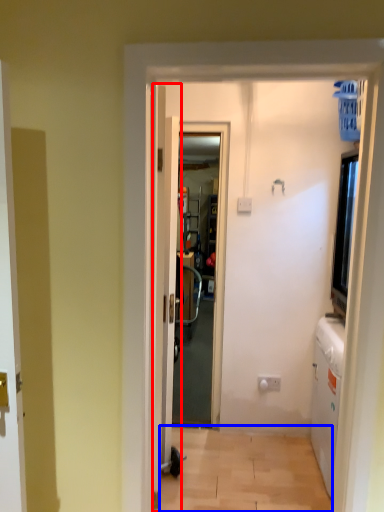
Question: Among these objects, which one is nearest to the camera, door (highlighted by a red box) or corridor (highlighted by a blue box)?

Choices:
 (A) door
 (B) corridor

Answer: (B)